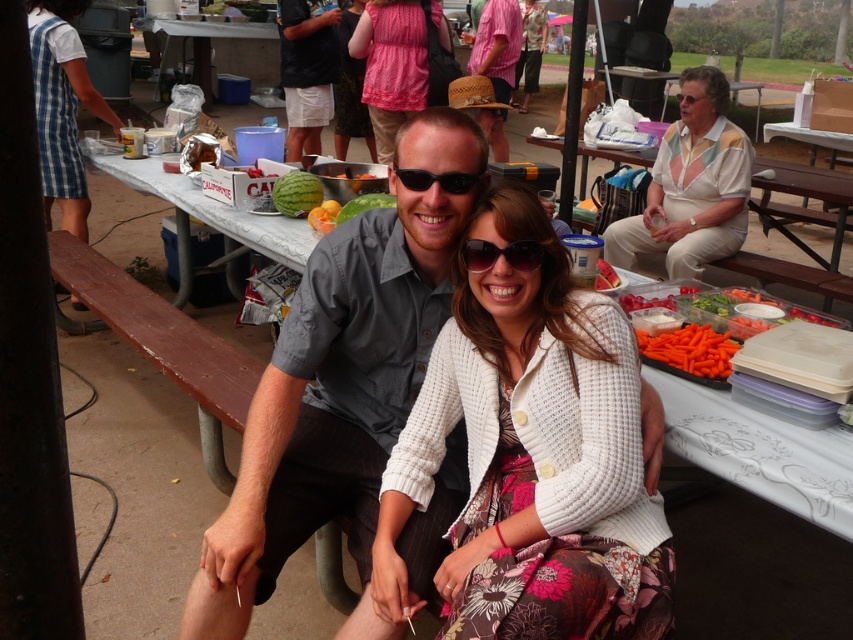
You are a photographer at the event and need to capture a photo of the pink fabric dress at center and the black cotton shorts at upper center. Can you see both items in the same frame without moving the camera?

The pink fabric dress at center is positioned over the black cotton shorts at upper center, so yes, both items are visible in the same frame as the dress covers part of the shorts but they are still in the same area.